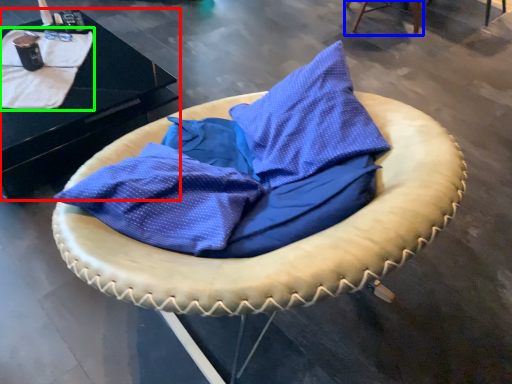
Question: Estimate the real-world distances between objects in this image. Which object is closer to table (highlighted by a red box), furniture (highlighted by a blue box) or blanket (highlighted by a green box)?

Choices:
 (A) furniture
 (B) blanket

Answer: (B)